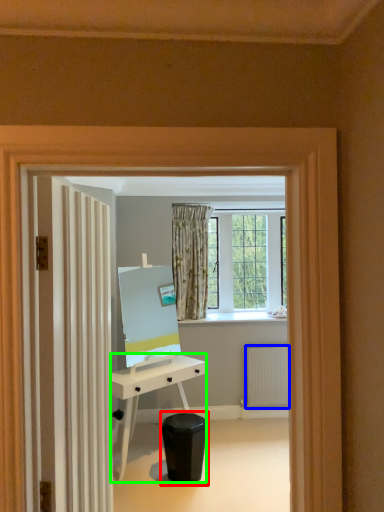
Question: Considering the real-world distances, which object is farthest from swivel chair (highlighted by a red box)? radiator (highlighted by a blue box) or desk (highlighted by a green box)?

Choices:
 (A) radiator
 (B) desk

Answer: (A)